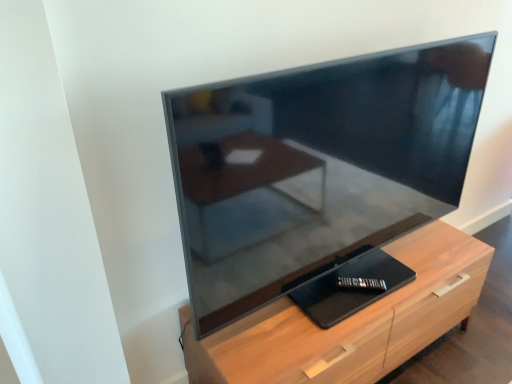
The height and width of the screenshot is (384, 512). What are the coordinates of `light wood chest of drawers at center` in the screenshot? It's located at (350, 322).

What do you see at coordinates (350, 322) in the screenshot? I see `light wood chest of drawers at center` at bounding box center [350, 322].

The height and width of the screenshot is (384, 512). What do you see at coordinates (320, 176) in the screenshot? I see `matte black tv at center` at bounding box center [320, 176].

This screenshot has height=384, width=512. I want to click on matte black tv at center, so click(320, 176).

In order to face matte black tv at center, should I rotate leftwards or rightwards?

Rotate right and turn 14.618 degrees.

Where is `light wood chest of drawers at center`? This screenshot has width=512, height=384. light wood chest of drawers at center is located at coordinates (350, 322).

Between matte black tv at center and light wood chest of drawers at center, which one appears on the left side from the viewer's perspective?

Positioned to the left is matte black tv at center.

From the picture: In the image, is matte black tv at center positioned in front of or behind light wood chest of drawers at center?

matte black tv at center is in front of light wood chest of drawers at center.

Considering the points (179, 129) and (392, 330), which point is behind, point (179, 129) or point (392, 330)?

Positioned behind is point (392, 330).

From the image's perspective, is matte black tv at center above or below light wood chest of drawers at center?

From the image's perspective, matte black tv at center appears above light wood chest of drawers at center.

From a real-world perspective, is matte black tv at center beneath light wood chest of drawers at center?

No.

Can you confirm if matte black tv at center is wider than light wood chest of drawers at center?

Incorrect, the width of matte black tv at center does not surpass that of light wood chest of drawers at center.

Between matte black tv at center and light wood chest of drawers at center, which one has more height?

With more height is matte black tv at center.

In terms of size, does matte black tv at center appear bigger or smaller than light wood chest of drawers at center?

In the image, matte black tv at center appears to be larger than light wood chest of drawers at center.

Can light wood chest of drawers at center be found inside matte black tv at center?

Actually, light wood chest of drawers at center is outside matte black tv at center.

Based on the photo, is matte black tv at center in contact with light wood chest of drawers at center?

No, matte black tv at center is not beside light wood chest of drawers at center.

Is matte black tv at center facing away from light wood chest of drawers at center?

No, light wood chest of drawers at center is not at the back of matte black tv at center.

Can you tell me how much matte black tv at center and light wood chest of drawers at center differ in facing direction?

matte black tv at center and light wood chest of drawers at center are facing 1.03 degrees away from each other.

Consider the image. How much distance is there between matte black tv at center and light wood chest of drawers at center?

They are 12.36 inches apart.

You are a GUI agent. You are given a task and a screenshot of the screen. Output one action in this format:
    pyautogui.click(x=<x>, y=<y>)
    Task: Click on the television above the light wood chest of drawers at center (from the image's perspective)
    The image size is (512, 384).
    Given the screenshot: What is the action you would take?
    pyautogui.click(x=320, y=176)

Is light wood chest of drawers at center to the left or to the right of matte black tv at center in the image?

In the image, light wood chest of drawers at center appears on the right side of matte black tv at center.

Is the position of light wood chest of drawers at center less distant than that of matte black tv at center?

No, light wood chest of drawers at center is behind matte black tv at center.

Is point (252, 366) closer to viewer compared to point (331, 129)?

Yes, it is.

From the image's perspective, relative to matte black tv at center, is light wood chest of drawers at center above or below?

Based on their image positions, light wood chest of drawers at center is located beneath matte black tv at center.

From a real-world perspective, is light wood chest of drawers at center physically below matte black tv at center?

Yes, from a real-world perspective, light wood chest of drawers at center is under matte black tv at center.

Consider the image. In terms of width, does light wood chest of drawers at center look wider or thinner when compared to matte black tv at center?

In the image, light wood chest of drawers at center appears to be wider than matte black tv at center.

Which of these two, light wood chest of drawers at center or matte black tv at center, stands taller?

matte black tv at center.

Consider the image. Considering the relative sizes of light wood chest of drawers at center and matte black tv at center in the image provided, is light wood chest of drawers at center bigger than matte black tv at center?

Incorrect, light wood chest of drawers at center is not larger than matte black tv at center.

Is matte black tv at center completely or partially inside light wood chest of drawers at center?

Definitely not — matte black tv at center is not inside light wood chest of drawers at center.

Is light wood chest of drawers at center not near matte black tv at center?

That's not correct — light wood chest of drawers at center is a little close to matte black tv at center.

Is light wood chest of drawers at center facing towards matte black tv at center?

No, light wood chest of drawers at center is not aimed at matte black tv at center.

The image size is (512, 384). Find the location of `the chest of drawers located below the matte black tv at center (from the image's perspective)`. the chest of drawers located below the matte black tv at center (from the image's perspective) is located at coordinates (350, 322).

The width and height of the screenshot is (512, 384). What are the coordinates of `television located above the light wood chest of drawers at center (from a real-world perspective)` in the screenshot? It's located at (320, 176).

You are a GUI agent. You are given a task and a screenshot of the screen. Output one action in this format:
    pyautogui.click(x=<x>, y=<y>)
    Task: Click on the television on the left side of light wood chest of drawers at center
    The width and height of the screenshot is (512, 384).
    Given the screenshot: What is the action you would take?
    pyautogui.click(x=320, y=176)